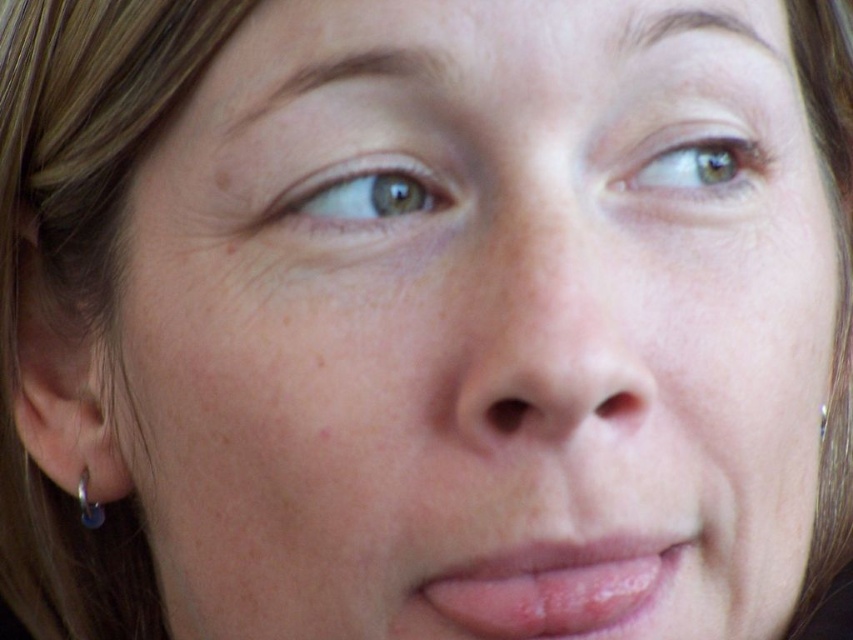
Question: Observing the image, what is the correct spatial positioning of brown matte eye at upper left in reference to silver metallic hoop at left ear?

Choices:
 (A) left
 (B) right

Answer: (A)

Question: Which point appears closest to the camera in this image?

Choices:
 (A) (753, 150)
 (B) (491, 600)
 (C) (398, 157)

Answer: (B)

Question: Which point is closer to the camera taking this photo?

Choices:
 (A) (763, 179)
 (B) (590, 593)
 (C) (416, 202)
 (D) (91, 529)

Answer: (B)

Question: Which of the following is the closest to the observer?

Choices:
 (A) silver metallic hoop at left ear
 (B) smooth skin nose at center
 (C) silver metallic earring at lower left
 (D) brown matte eye at upper left

Answer: (B)

Question: Is smooth skin nose at center wider than brown matte eye at upper left?

Choices:
 (A) no
 (B) yes

Answer: (B)

Question: Does pink glossy lips at center appear under silver metallic earring at lower left?

Choices:
 (A) yes
 (B) no

Answer: (B)